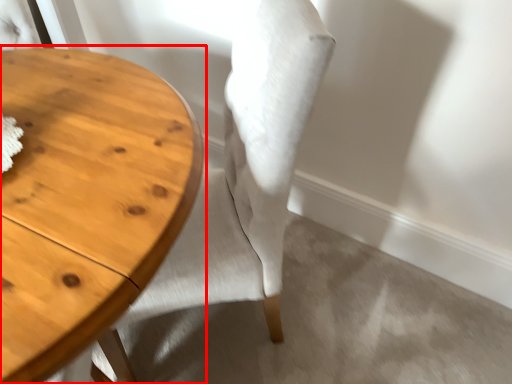
Question: Considering the relative positions of table (annotated by the red box) and chair in the image provided, where is table (annotated by the red box) located with respect to the staircase?

Choices:
 (A) right
 (B) left

Answer: (B)